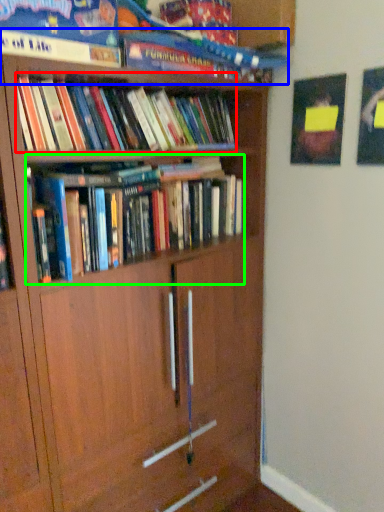
Question: Which object is the closest to the book (highlighted by a red box)? Choose among these: book (highlighted by a blue box) or book (highlighted by a green box).

Choices:
 (A) book
 (B) book

Answer: (A)